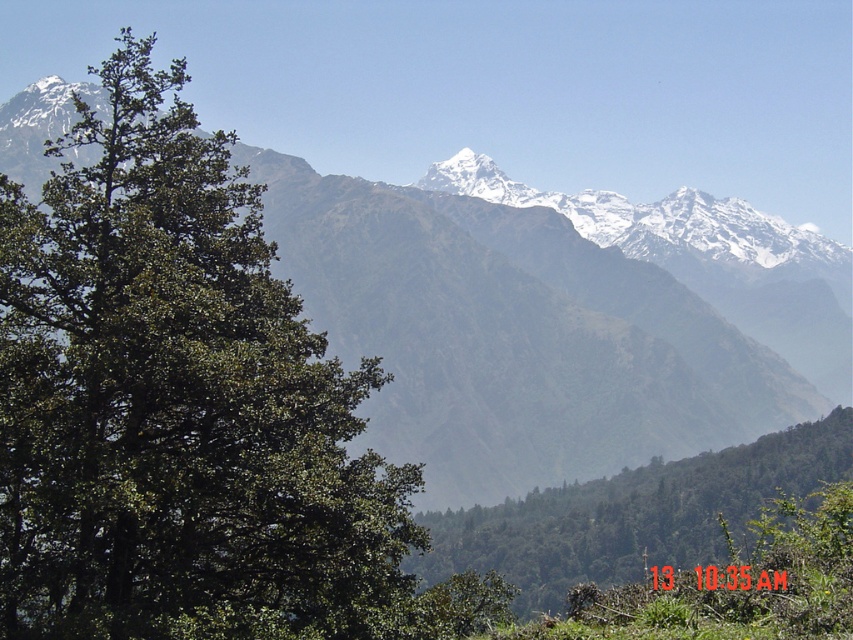
Which is in front, point (480, 500) or point (590, 492)?

Point (590, 492) is in front.

Between green textured mountain range at center and green leafy tree at center, which one is positioned lower?

green leafy tree at center is lower down.

Who is more distant from viewer, (769, 428) or (711, 464)?

The point (769, 428) is more distant.

I want to click on green textured mountain range at center, so click(512, 337).

Is green leafy tree at left closer to the viewer compared to green leafy tree at center?

Yes, it is in front of green leafy tree at center.

Which of these two, green leafy tree at left or green leafy tree at center, stands taller?

green leafy tree at left

Is point (109, 436) less distant than point (521, 502)?

Yes, it is in front of point (521, 502).

Where is `green leafy tree at left`? green leafy tree at left is located at coordinates (178, 403).

Who is positioned more to the left, green leafy tree at left or green textured mountain range at center?

green leafy tree at left

Between point (338, 579) and point (521, 340), which one is positioned behind?

The point (521, 340) is behind.

This screenshot has height=640, width=853. Identify the location of green leafy tree at left. click(178, 403).